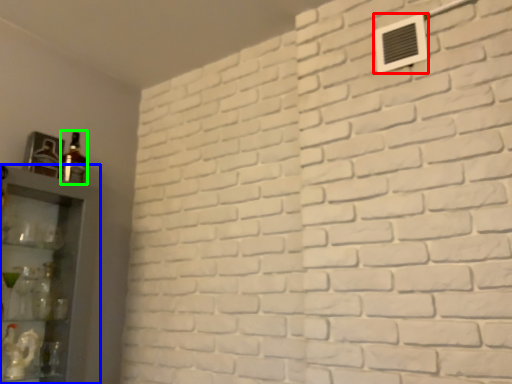
Question: Which object is the closest to the air conditioning (highlighted by a red box)? Choose among these: shelf (highlighted by a blue box) or bottle (highlighted by a green box).

Choices:
 (A) shelf
 (B) bottle

Answer: (B)